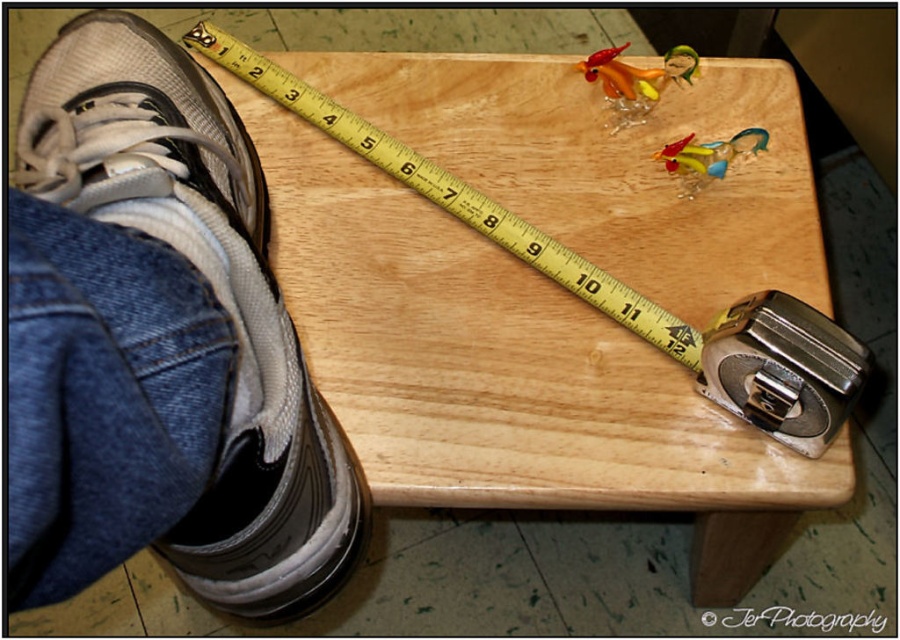
Question: Is white mesh shoe at lower left thinner than metallic silver tape at lower right?

Choices:
 (A) no
 (B) yes

Answer: (A)

Question: Among these objects, which one is nearest to the camera?

Choices:
 (A) yellow/yellowish wood ruler at upper center
 (B) wooden at upper center

Answer: (B)

Question: Is yellow/yellowish wood ruler at upper center wider than translucent glass figurine at upper center?

Choices:
 (A) yes
 (B) no

Answer: (A)

Question: Is the position of yellow/yellowish wood ruler at upper center more distant than that of translucent glass figurine at upper right?

Choices:
 (A) yes
 (B) no

Answer: (B)

Question: Which object appears farthest from the camera in this image?

Choices:
 (A) translucent glass figurine at upper center
 (B) wooden at upper center
 (C) white mesh shoe at lower left
 (D) yellow/yellowish wood ruler at upper center

Answer: (A)

Question: Which point is farther to the camera?

Choices:
 (A) (104, 19)
 (B) (516, 257)
 (C) (776, 371)
 (D) (709, 160)

Answer: (D)